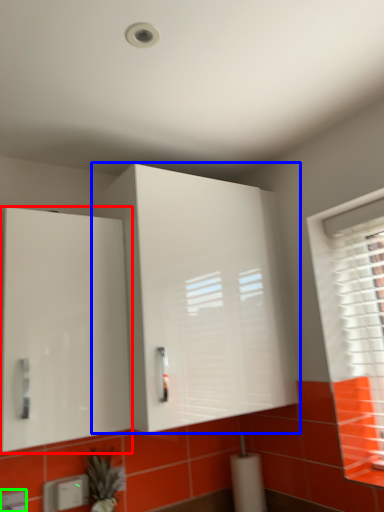
Question: Which object is positioned closest to cabinetry (highlighted by a red box)? Select from cabinetry (highlighted by a blue box) and electric outlet (highlighted by a green box).

Choices:
 (A) cabinetry
 (B) electric outlet

Answer: (A)